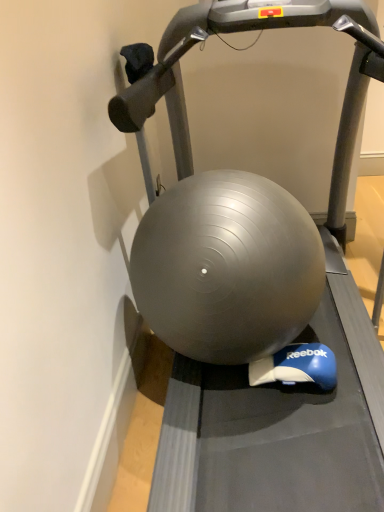
Question: Is there a large distance between matte gray ball at center and silver metallic treadmill at center?

Choices:
 (A) yes
 (B) no

Answer: (B)

Question: Is silver metallic treadmill at center located within matte gray ball at center?

Choices:
 (A) yes
 (B) no

Answer: (B)

Question: Is matte gray ball at center closer to camera compared to silver metallic treadmill at center?

Choices:
 (A) no
 (B) yes

Answer: (A)

Question: Does matte gray ball at center have a greater height compared to silver metallic treadmill at center?

Choices:
 (A) no
 (B) yes

Answer: (A)

Question: Considering the relative sizes of matte gray ball at center and silver metallic treadmill at center in the image provided, is matte gray ball at center shorter than silver metallic treadmill at center?

Choices:
 (A) no
 (B) yes

Answer: (B)

Question: Considering the relative sizes of matte gray ball at center and silver metallic treadmill at center in the image provided, is matte gray ball at center wider than silver metallic treadmill at center?

Choices:
 (A) no
 (B) yes

Answer: (A)

Question: Is silver metallic treadmill at center facing away from matte gray ball at center?

Choices:
 (A) no
 (B) yes

Answer: (B)

Question: Could matte gray ball at center be considered to be inside silver metallic treadmill at center?

Choices:
 (A) yes
 (B) no

Answer: (A)

Question: Is silver metallic treadmill at center not near matte gray ball at center?

Choices:
 (A) no
 (B) yes

Answer: (A)

Question: Could you tell me if silver metallic treadmill at center is facing matte gray ball at center?

Choices:
 (A) yes
 (B) no

Answer: (A)

Question: From a real-world perspective, is silver metallic treadmill at center on top of matte gray ball at center?

Choices:
 (A) no
 (B) yes

Answer: (B)

Question: Is silver metallic treadmill at center placed right next to matte gray ball at center?

Choices:
 (A) yes
 (B) no

Answer: (A)

Question: Is matte gray ball at center to the left or to the right of silver metallic treadmill at center in the image?

Choices:
 (A) left
 (B) right

Answer: (A)